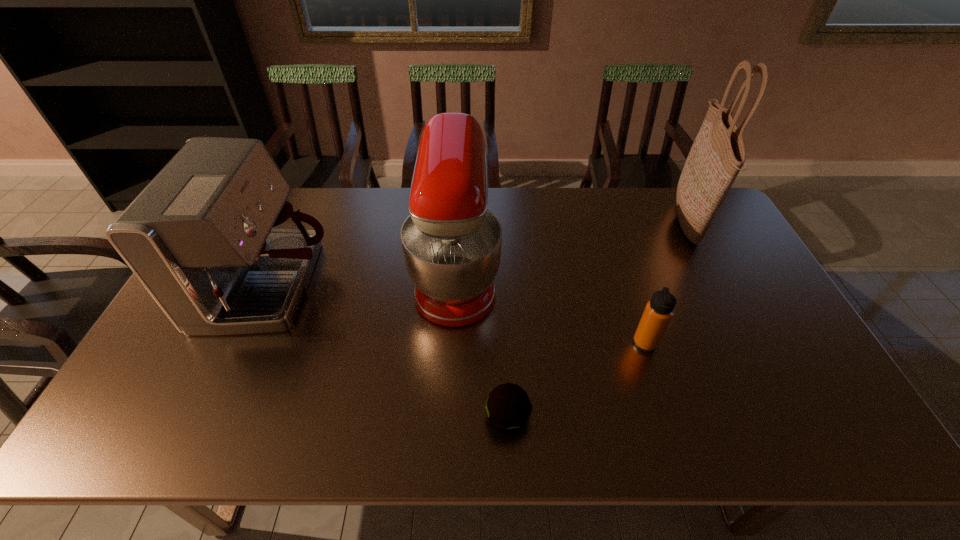
At what (x,y) coordinates should I click in order to perform the action: click on vacant space at the near edge of the desktop. Please return your answer as a coordinate pair (x, y). This screenshot has height=540, width=960. Looking at the image, I should click on (631, 446).

I want to click on free space at the near right corner of the desktop, so click(780, 417).

The width and height of the screenshot is (960, 540). What are the coordinates of `vacant space in between the leftmost object and the mixer` in the screenshot? It's located at (364, 280).

You are a GUI agent. You are given a task and a screenshot of the screen. Output one action in this format:
    pyautogui.click(x=<x>, y=<y>)
    Task: Click on the free space that is in between the patty and the tallest object
    The image size is (960, 540).
    Given the screenshot: What is the action you would take?
    (597, 319)

Locate an element on the screen. This screenshot has height=540, width=960. free space that is in between the second object from right to left and the nearest object is located at coordinates (576, 380).

Locate an element on the screen. The image size is (960, 540). vacant area between the mixer and the second object from right to left is located at coordinates (551, 308).

This screenshot has width=960, height=540. I want to click on vacant point located between the mixer and the coffee maker, so click(364, 280).

You are a GUI agent. You are given a task and a screenshot of the screen. Output one action in this format:
    pyautogui.click(x=<x>, y=<y>)
    Task: Click on the vacant area between the tallest object and the thermos bottle
    The height and width of the screenshot is (540, 960).
    Given the screenshot: What is the action you would take?
    pyautogui.click(x=666, y=282)

Locate an element on the screen. empty space between the coffee maker and the mixer is located at coordinates (364, 280).

Identify the location of blank region between the coffee maker and the mixer. The image size is (960, 540). (364, 280).